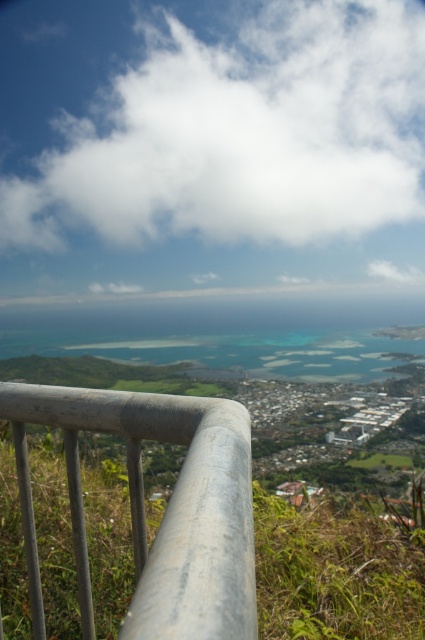
Is white fluffy cloud at upper center positioned before silver metallic rail at center?

No, it is behind silver metallic rail at center.

Who is taller, white fluffy cloud at upper center or silver metallic rail at center?

white fluffy cloud at upper center

Does point (258, 122) come closer to viewer compared to point (249, 547)?

No, (258, 122) is behind (249, 547).

Image resolution: width=425 pixels, height=640 pixels. In order to click on white fluffy cloud at upper center in this screenshot , I will do `click(243, 132)`.